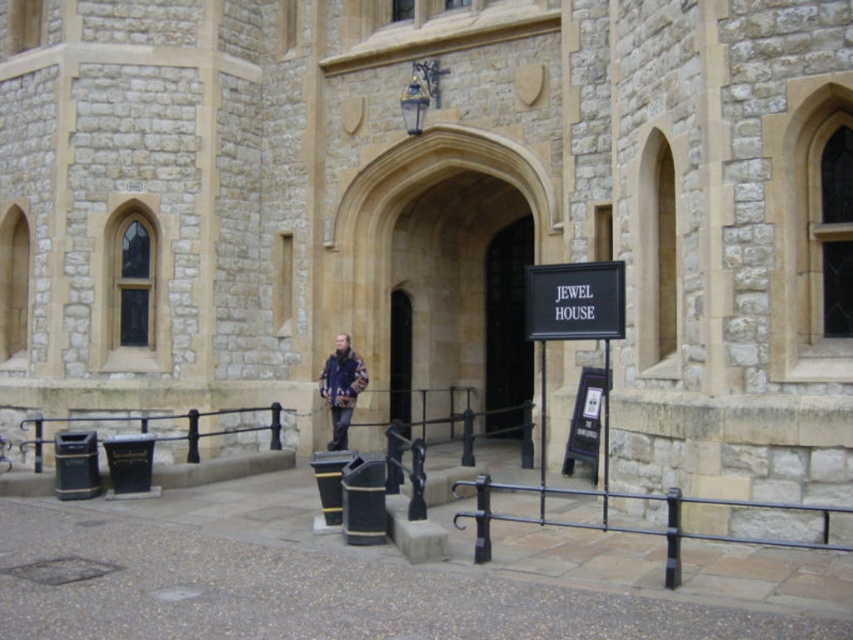
Looking at this image, between black matte sign at center and flannel jacket at center, which one appears on the right side from the viewer's perspective?

From the viewer's perspective, black matte sign at center appears more on the right side.

Who is taller, black matte sign at center or flannel jacket at center?

Standing taller between the two is flannel jacket at center.

Is point (537, 321) more distant than point (337, 445)?

No, it is in front of (337, 445).

Identify the location of black matte sign at center. This screenshot has width=853, height=640. (573, 301).

What do you see at coordinates (508, 328) in the screenshot? I see `dark stone archway at center` at bounding box center [508, 328].

Between dark stone archway at center and flannel jacket at center, which one is positioned lower?

Positioned lower is flannel jacket at center.

Measure the distance between point [518,404] and camera.

23.65 meters

Image resolution: width=853 pixels, height=640 pixels. Identify the location of dark stone archway at center. (508, 328).

Does point (590, 288) come farther from viewer compared to point (405, 307)?

No.

Between point (608, 285) and point (399, 340), which one is positioned behind?

The point (399, 340) is behind.

Is point (599, 333) less distant than point (401, 307)?

Yes, it is in front of point (401, 307).

The height and width of the screenshot is (640, 853). Identify the location of black matte sign at center. (573, 301).